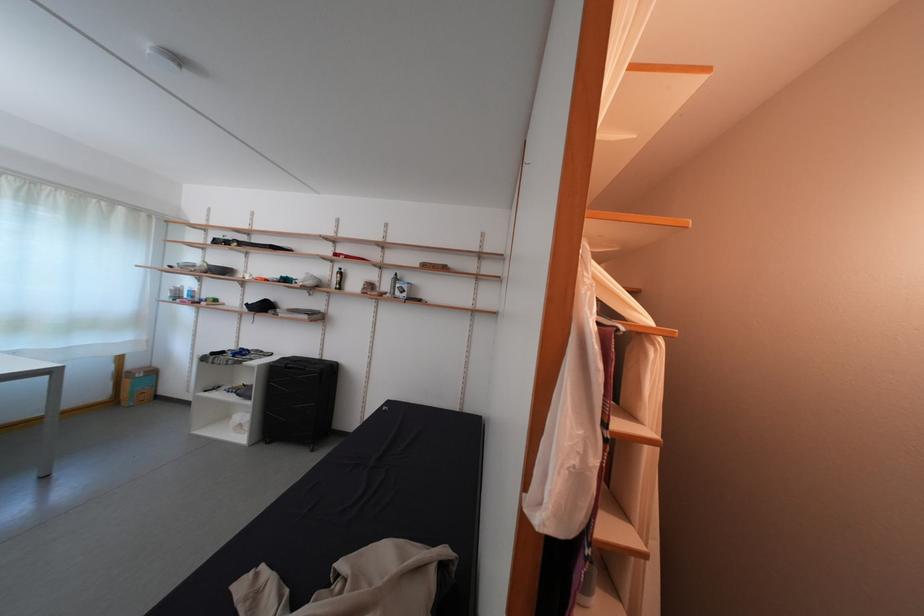
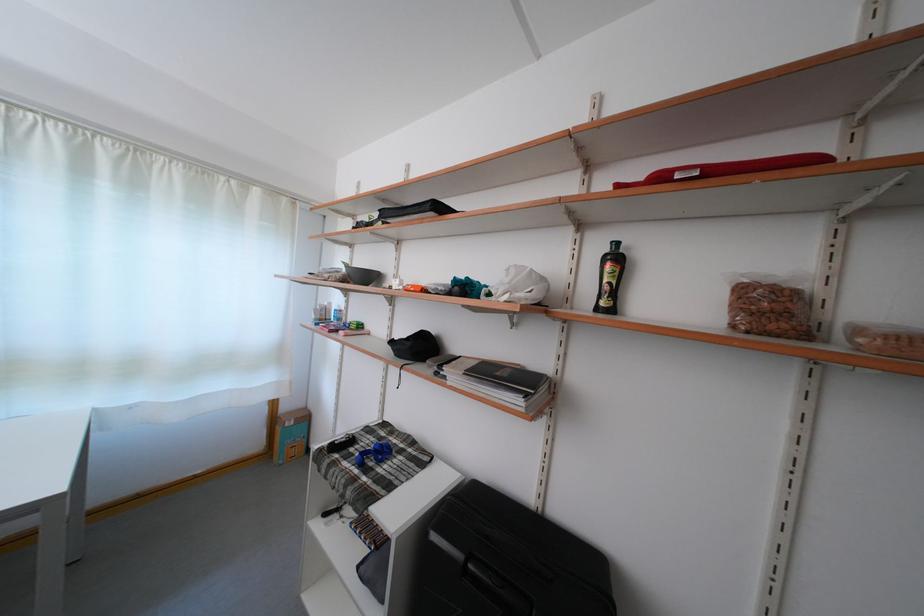
Where in the second image is the point corresponding to pixel 140 371 from the first image?

(293, 415)